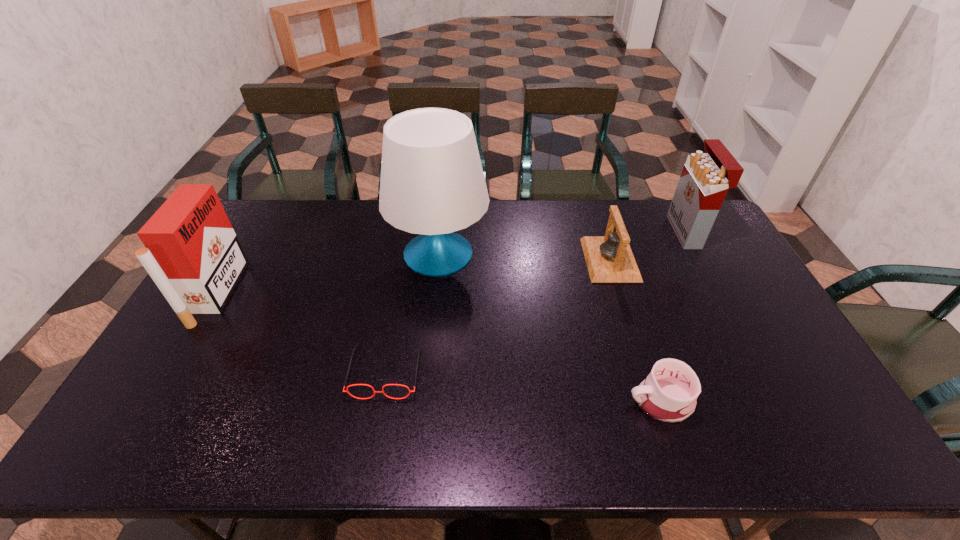
At what (x,y) coordinates should I click in order to perform the action: click on the tallest object. Please return your answer as a coordinate pair (x, y). Looking at the image, I should click on (432, 183).

The height and width of the screenshot is (540, 960). What are the coordinates of `the farther cigarette case` in the screenshot? It's located at (706, 177).

Locate an element on the screen. The width and height of the screenshot is (960, 540). the right cigarette case is located at coordinates (706, 177).

This screenshot has width=960, height=540. Find the location of `the leftmost object`. the leftmost object is located at coordinates (193, 255).

Locate an element on the screen. the nearer cigarette case is located at coordinates (193, 255).

Find the location of a particular element. The image size is (960, 540). bell is located at coordinates (609, 258).

I want to click on mug, so pos(669,393).

Identify the location of spectacles. The image size is (960, 540). (374, 391).

Find the location of `vacant space situated 0.340m on the front-facing side of the tallest object`. vacant space situated 0.340m on the front-facing side of the tallest object is located at coordinates (425, 383).

I want to click on vacant space situated with the lid open on the rightmost object, so click(586, 232).